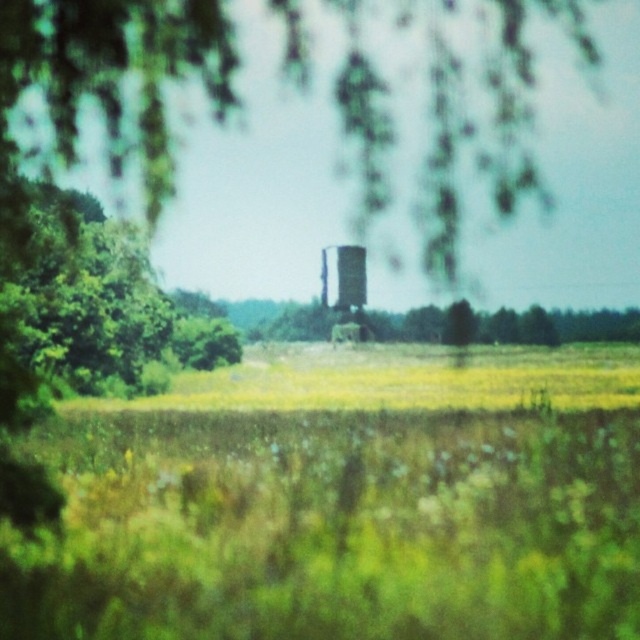
Is the position of green leafy tree at left less distant than that of green matte tree at center?

Yes, it is.

Between point (80, 280) and point (252, 330), which one is positioned in front?

Point (80, 280) is in front.

Who is more distant from viewer, (132, 296) or (618, 321)?

The point (618, 321) is behind.

Locate an element on the screen. green leafy tree at left is located at coordinates (100, 307).

Looking at this image, between green leafy tree at left and metallic silver water tower at center, which one appears on the right side from the viewer's perspective?

Positioned to the right is metallic silver water tower at center.

Can you confirm if green leafy tree at left is taller than metallic silver water tower at center?

Yes.

Does point (74, 204) come farther from viewer compared to point (337, 298)?

No, it is in front of (337, 298).

Identify the location of green leafy tree at left. Image resolution: width=640 pixels, height=640 pixels. (100, 307).

Does green matte tree at center have a greater width compared to metallic silver water tower at center?

Yes.

Is green matte tree at center smaller than metallic silver water tower at center?

No.

Does point (378, 324) come closer to viewer compared to point (360, 291)?

No, (378, 324) is behind (360, 291).

At what (x,y) coordinates should I click in order to perform the action: click on green matte tree at center. Please return your answer as a coordinate pair (x, y). Looking at the image, I should click on (595, 324).